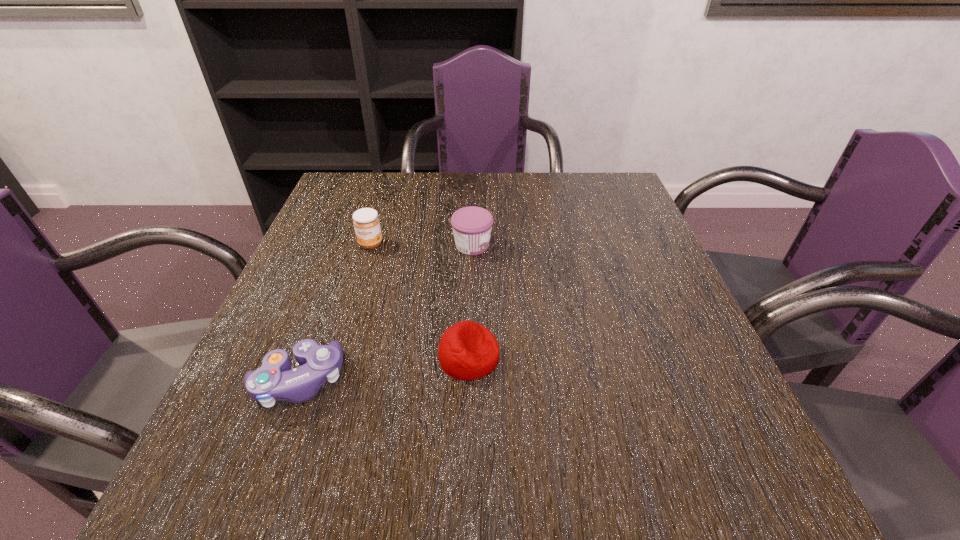
Locate an element on the screen. the left jam is located at coordinates (366, 222).

The width and height of the screenshot is (960, 540). I want to click on the right jam, so click(x=472, y=226).

The width and height of the screenshot is (960, 540). Identify the location of control. (274, 381).

Where is `the shortest object`? The image size is (960, 540). the shortest object is located at coordinates (467, 350).

The height and width of the screenshot is (540, 960). Find the location of `vacant point located on the front label of the left jam`. vacant point located on the front label of the left jam is located at coordinates (358, 286).

Where is `free spot located 0.140m on the front label of the right jam`? free spot located 0.140m on the front label of the right jam is located at coordinates click(x=552, y=245).

Locate an element on the screen. This screenshot has width=960, height=540. vacant space located on the back of the control is located at coordinates (323, 316).

Identify the location of vacant space located on the seat area of the shortest object. The width and height of the screenshot is (960, 540). (642, 357).

Find the location of a particular element. This screenshot has width=960, height=540. jam at the left edge is located at coordinates (366, 222).

Where is `control located at the left edge`? This screenshot has width=960, height=540. control located at the left edge is located at coordinates (274, 381).